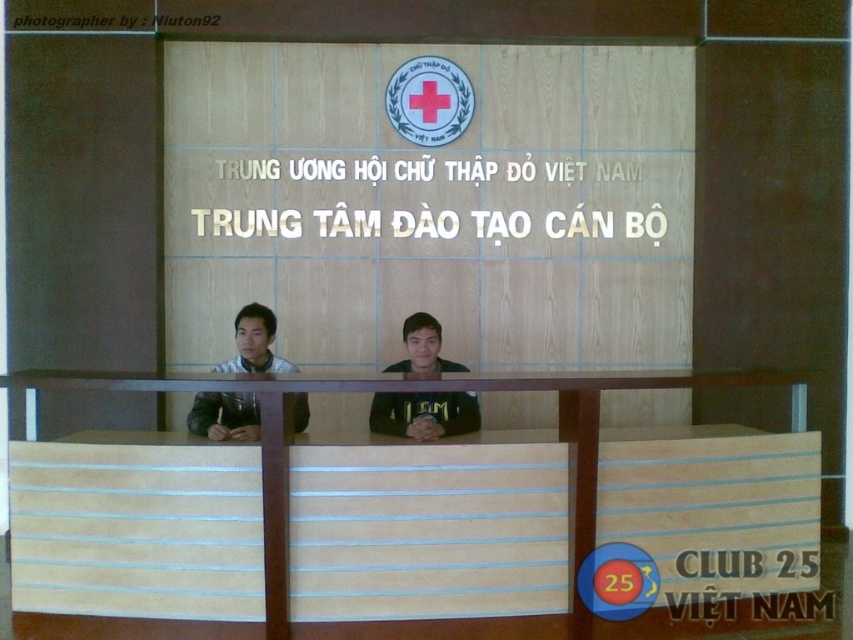
Is light brown wood at center bigger than matte black jacket at center?

Yes, light brown wood at center is bigger than matte black jacket at center.

Based on the photo, which is below, light brown wood at center or matte black jacket at center?

light brown wood at center

Is point (567, 396) in front of point (253, 337)?

Yes, point (567, 396) is in front of point (253, 337).

Identify the location of light brown wood at center. The image size is (853, 640). (419, 388).

Does light brown wood at center have a larger size compared to black matte shirt at center?

Yes, light brown wood at center is bigger than black matte shirt at center.

Between light brown wood at center and black matte shirt at center, which one appears on the right side from the viewer's perspective?

light brown wood at center is more to the right.

At what (x,y) coordinates should I click in order to perform the action: click on light brown wood at center. Please return your answer as a coordinate pair (x, y). This screenshot has height=640, width=853. Looking at the image, I should click on (419, 388).

Who is taller, black matte shirt at center or matte black jacket at center?

matte black jacket at center is taller.

What are the coordinates of `black matte shirt at center` in the screenshot? It's located at (424, 413).

You are a GUI agent. You are given a task and a screenshot of the screen. Output one action in this format:
    pyautogui.click(x=<x>, y=<y>)
    Task: Click on the black matte shirt at center
    The width and height of the screenshot is (853, 640).
    Given the screenshot: What is the action you would take?
    pyautogui.click(x=424, y=413)